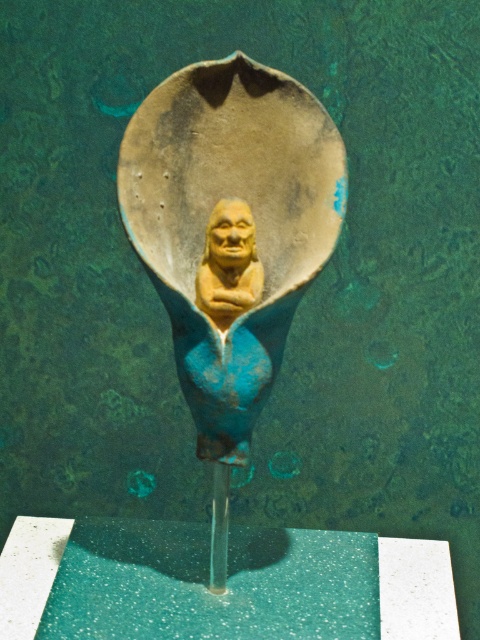
Which is in front, point (128, 212) or point (240, 285)?

Positioned in front is point (128, 212).

Who is more distant from viewer, (261, 337) or (228, 268)?

Point (228, 268)

The image size is (480, 640). I want to click on matte yellow figure at center, so click(x=229, y=236).